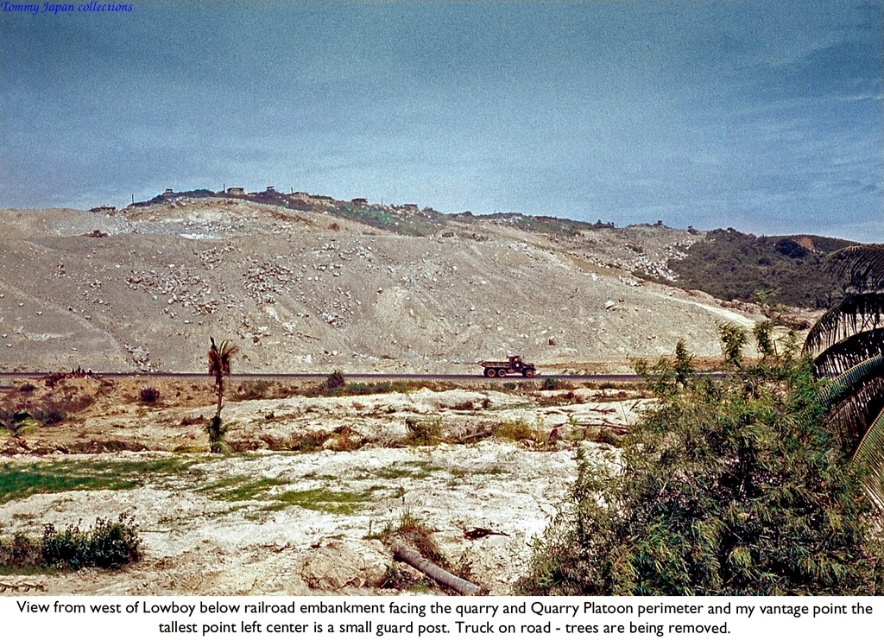
Question: Among these objects, which one is nearest to the camera?

Choices:
 (A) dull gray rock at center
 (B) brown dirt road at center

Answer: (B)

Question: Is dull gray rock at center smaller than brown dirt road at center?

Choices:
 (A) yes
 (B) no

Answer: (B)

Question: Does dull gray rock at center have a lesser width compared to brown dirt road at center?

Choices:
 (A) yes
 (B) no

Answer: (B)

Question: Which point is farther to the camera?

Choices:
 (A) dull gray rock at center
 (B) brown dirt road at center

Answer: (A)

Question: Which point is closer to the camera taking this photo?

Choices:
 (A) (311, 300)
 (B) (603, 378)

Answer: (B)

Question: Can you confirm if dull gray rock at center is bigger than brown dirt road at center?

Choices:
 (A) no
 (B) yes

Answer: (B)